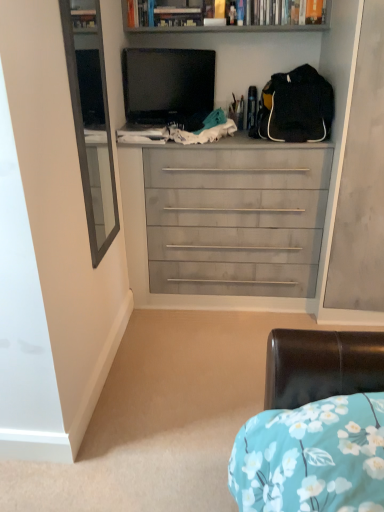
The height and width of the screenshot is (512, 384). I want to click on wooden bookshelf at upper center, so click(167, 19).

What is the approximate height of wooden bookshelf at upper center?

7.10 inches.

This screenshot has width=384, height=512. Describe the element at coordinates (168, 86) in the screenshot. I see `matte black tv at upper center` at that location.

Identify the location of matte black tv at upper center. This screenshot has height=512, width=384. (168, 86).

At what (x,y) coordinates should I click in order to perform the action: click on wooden bookshelf at upper center. Please return your answer as a coordinate pair (x, y). This screenshot has height=512, width=384. Looking at the image, I should click on (167, 19).

Which is closer, (268, 136) or (316, 165)?

Point (268, 136).

Is black matte backpack at upper right inside the boundaries of matte gray chest of drawers at center, or outside?

black matte backpack at upper right is outside matte gray chest of drawers at center.

The image size is (384, 512). In order to click on the chest of drawers that appears below the black matte backpack at upper right (from a real-world perspective) in this screenshot , I will do `click(235, 220)`.

From the image's perspective, is black matte backpack at upper right above matte gray chest of drawers at center?

Yes, from the image's perspective, black matte backpack at upper right is on top of matte gray chest of drawers at center.

From the image's perspective, would you say wooden bookshelf at upper center is shown under hardcover book at upper center?

Indeed, from the image's perspective, wooden bookshelf at upper center is shown beneath hardcover book at upper center.

From a real-world perspective, is wooden bookshelf at upper center located beneath hardcover book at upper center?

Yes, from a real-world perspective, wooden bookshelf at upper center is beneath hardcover book at upper center.

Which is behind, point (291, 8) or point (142, 0)?

The point (142, 0) is behind.

Is hardcover book at upper center located within wooden bookshelf at upper center?

Indeed, hardcover book at upper center is located within wooden bookshelf at upper center.

How many degrees apart are the facing directions of wooden bookshelf at upper center and matte black tv at upper center?

They differ by 31.8 degrees in their facing directions.

Identify the location of bookcase on the right of matte black tv at upper center. (167, 19).

Is there a large distance between wooden bookshelf at upper center and matte black tv at upper center?

wooden bookshelf at upper center is actually quite close to matte black tv at upper center.

Is wooden bookshelf at upper center situated inside matte black tv at upper center or outside?

wooden bookshelf at upper center is outside matte black tv at upper center.

Find the location of a particular element. book lying on the left of black matte backpack at upper right is located at coordinates (140, 13).

Which object is positioned more to the right, hardcover book at upper center or black matte backpack at upper right?

Positioned to the right is black matte backpack at upper right.

From a real-world perspective, is hardcover book at upper center beneath black matte backpack at upper right?

No, from a real-world perspective, hardcover book at upper center is not below black matte backpack at upper right.

Looking at this image, considering the sizes of objects hardcover book at upper center and black matte backpack at upper right in the image provided, who is taller, hardcover book at upper center or black matte backpack at upper right?

black matte backpack at upper right is taller.

Does matte gray chest of drawers at center come behind wooden bookshelf at upper center?

No.

Is matte gray chest of drawers at center far away from wooden bookshelf at upper center?

Actually, matte gray chest of drawers at center and wooden bookshelf at upper center are a little close together.

From the picture: Is matte gray chest of drawers at center situated inside wooden bookshelf at upper center or outside?

matte gray chest of drawers at center is not inside wooden bookshelf at upper center, it's outside.

Looking at this image, is matte gray chest of drawers at center to the left of wooden bookshelf at upper center from the viewer's perspective?

Yes, matte gray chest of drawers at center is to the left of wooden bookshelf at upper center.

Which of these two, matte black tv at upper center or wooden bookshelf at upper center, stands shorter?

wooden bookshelf at upper center is shorter.

Identify the location of television below the wooden bookshelf at upper center (from the image's perspective). (168, 86).

Is matte black tv at upper center oriented towards wooden bookshelf at upper center?

No.

Is matte gray chest of drawers at center to the left of matte black tv at upper center from the viewer's perspective?

In fact, matte gray chest of drawers at center is to the right of matte black tv at upper center.

Is matte gray chest of drawers at center aimed at matte black tv at upper center?

No, matte gray chest of drawers at center is not turned towards matte black tv at upper center.

In the scene shown: Can we say matte gray chest of drawers at center lies outside matte black tv at upper center?

matte gray chest of drawers at center is positioned outside matte black tv at upper center.

Is matte gray chest of drawers at center beside matte black tv at upper center?

matte gray chest of drawers at center and matte black tv at upper center are clearly separated.

This screenshot has height=512, width=384. What are the coordinates of `the chest of drawers that appears behind the black matte backpack at upper right` in the screenshot? It's located at (235, 220).

The image size is (384, 512). In order to click on book above the wooden bookshelf at upper center (from a real-world perspective) in this screenshot , I will do pyautogui.click(x=140, y=13).

Which object lies nearer to the anchor point black matte backpack at upper right, hardcover book at upper center or matte black tv at upper center?

matte black tv at upper center is closer to black matte backpack at upper right.

From the image, which object appears to be nearer to matte black tv at upper center, black matte backpack at upper right or hardcover book at upper center?

Among the two, hardcover book at upper center is located nearer to matte black tv at upper center.

Estimate the real-world distances between objects in this image. Which object is further from matte gray chest of drawers at center, wooden bookshelf at upper center or matte black tv at upper center?

Based on the image, wooden bookshelf at upper center appears to be further to matte gray chest of drawers at center.

From the image, which object appears to be nearer to hardcover book at upper center, black matte backpack at upper right or wooden bookshelf at upper center?

Among the two, wooden bookshelf at upper center is located nearer to hardcover book at upper center.

Considering their positions, is matte black tv at upper center positioned closer to wooden bookshelf at upper center than hardcover book at upper center?

The object closer to wooden bookshelf at upper center is hardcover book at upper center.

Looking at the image, which one is located further to black matte backpack at upper right, matte gray chest of drawers at center or matte black tv at upper center?

matte black tv at upper center.

Considering their positions, is hardcover book at upper center positioned further to matte black tv at upper center than matte gray chest of drawers at center?

matte gray chest of drawers at center is further to matte black tv at upper center.

When comparing their distances from matte black tv at upper center, does hardcover book at upper center or wooden bookshelf at upper center seem further?

hardcover book at upper center is positioned further to the anchor matte black tv at upper center.

You are a GUI agent. You are given a task and a screenshot of the screen. Output one action in this format:
    pyautogui.click(x=<x>, y=<y>)
    Task: Click on the television between hardcover book at upper center and wooden bookshelf at upper center from left to right
    Image resolution: width=384 pixels, height=512 pixels.
    Given the screenshot: What is the action you would take?
    pyautogui.click(x=168, y=86)

At what (x,y) coordinates should I click in order to perform the action: click on bookcase between hardcover book at upper center and matte gray chest of drawers at center in the vertical direction. Please return your answer as a coordinate pair (x, y). Looking at the image, I should click on (x=167, y=19).

The height and width of the screenshot is (512, 384). Identify the location of backpack between wooden bookshelf at upper center and matte gray chest of drawers at center in the vertical direction. (296, 106).

The width and height of the screenshot is (384, 512). Identify the location of television that lies between wooden bookshelf at upper center and matte gray chest of drawers at center from top to bottom. (168, 86).